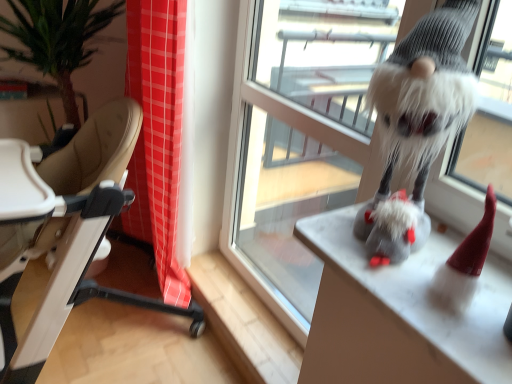
Where is `vacant space underneath beige leather highchair at left (from a real-world perspective)`? The image size is (512, 384). vacant space underneath beige leather highchair at left (from a real-world perspective) is located at coordinates (94, 335).